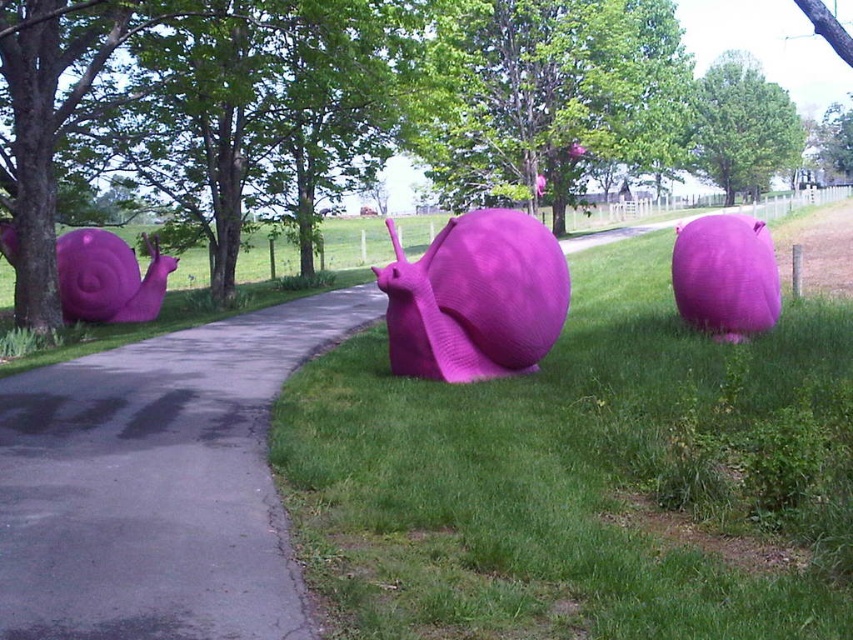
Between matte plastic snail at center and matte pink snail at right, which one appears on the left side from the viewer's perspective?

From the viewer's perspective, matte plastic snail at center appears more on the left side.

Who is more distant from viewer, (x=532, y=355) or (x=724, y=250)?

The point (x=724, y=250) is behind.

At what (x,y) coordinates should I click in order to perform the action: click on matte plastic snail at center. Please return your answer as a coordinate pair (x, y). Image resolution: width=853 pixels, height=640 pixels. Looking at the image, I should click on (474, 298).

Is point (442, 372) positioned in front of point (119, 262)?

Yes, point (442, 372) is in front of point (119, 262).

Image resolution: width=853 pixels, height=640 pixels. What do you see at coordinates (474, 298) in the screenshot?
I see `matte plastic snail at center` at bounding box center [474, 298].

The height and width of the screenshot is (640, 853). What are the coordinates of `matte plastic snail at center` in the screenshot? It's located at (474, 298).

Who is more distant from viewer, (368,486) or (279,616)?

The point (368,486) is behind.

Is point (592, 374) behind point (189, 620)?

Yes.

Image resolution: width=853 pixels, height=640 pixels. What are the coordinates of `purple matte snail at center` in the screenshot? It's located at (552, 477).

Locate an element on the screen. The image size is (853, 640). purple matte snail at center is located at coordinates (552, 477).